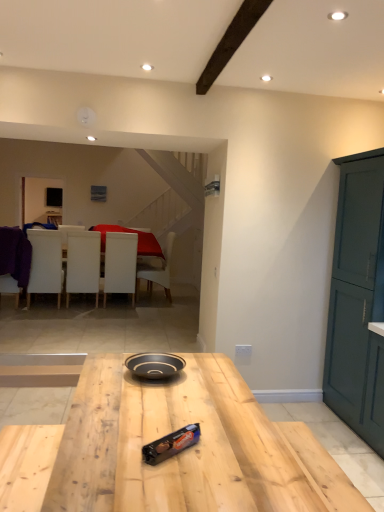
Where is `free region under matte black bowl at center (from a real-world perspective)`? free region under matte black bowl at center (from a real-world perspective) is located at coordinates (163, 375).